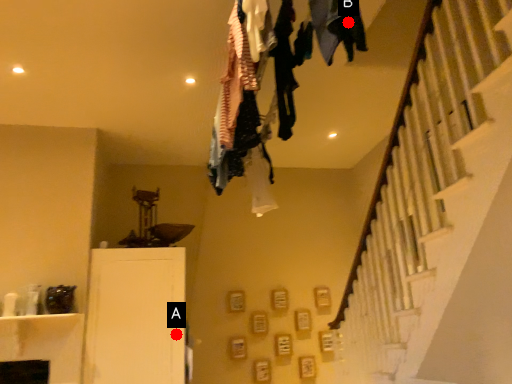
Question: Two points are circled on the image, labeled by A and B beside each circle. Which point appears farthest from the camera in this image?

Choices:
 (A) A is further
 (B) B is further

Answer: (A)